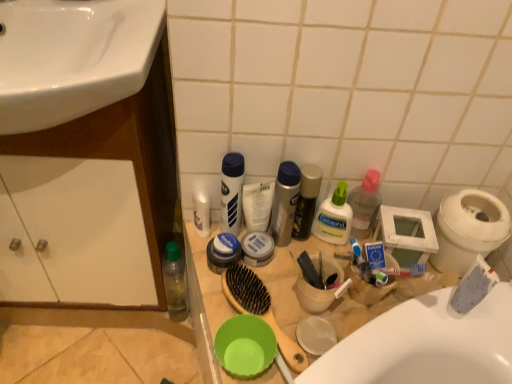
The height and width of the screenshot is (384, 512). I want to click on vacant area in front of white pump bottle at center, which is the seventh toiletry from left to right, so click(x=344, y=296).